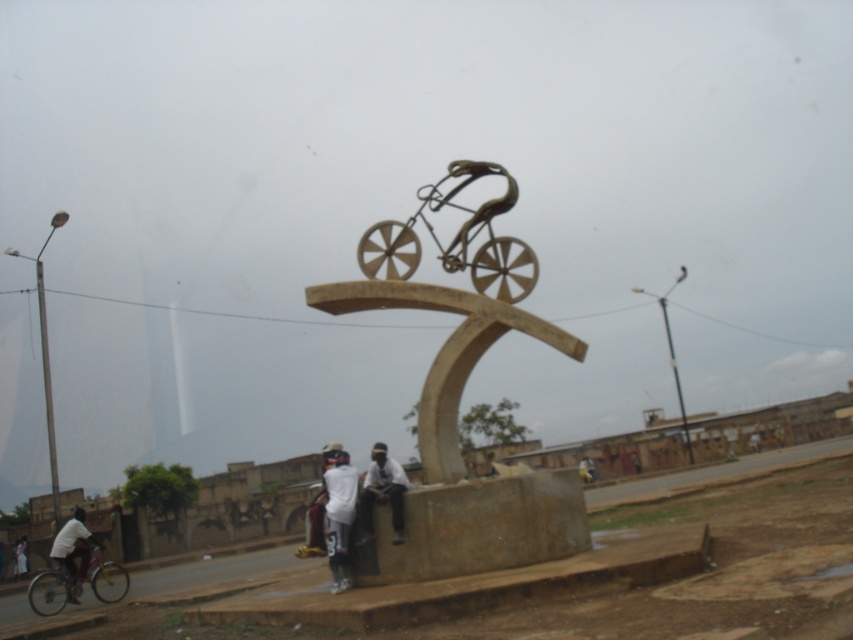
You are a photographer trying to capture the sculpture and the people around it. You notice the white matte shirt at lower center and the white clothed cyclist at lower left. Which one is closer to the camera?

The white matte shirt at lower center is in front of the white clothed cyclist at lower left, so it is closer to the camera.

You are a photographer standing in front of the sculpture. You want to take a photo of the silver metallic bicycle at lower left and the white matte shirt at lower center. Which object should you focus on first to ensure both are in the frame?

You should focus on the silver metallic bicycle at lower left first because it is closer to you than the white matte shirt at lower center, ensuring both are in the frame.

You are an artist planning to sketch the bronze bicycle at center and the white matte jacket at lower center. If you want to ensure both subjects fit on your canvas, which one should you draw first to account for their sizes?

The bronze bicycle at center is wider than the white matte jacket at lower center, so you should draw the bronze bicycle at center first to accommodate its larger size on the canvas.